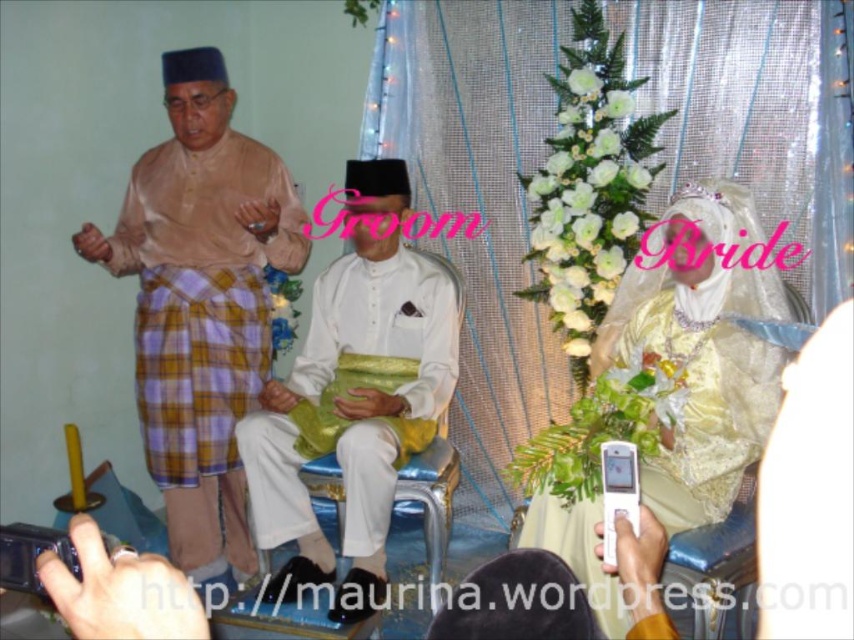
Question: From the image, what is the correct spatial relationship of matte brown shirt at left in relation to white satin dress at upper right?

Choices:
 (A) above
 (B) below

Answer: (A)

Question: Based on their relative distances, which object is farther from the white satin dress at upper right?

Choices:
 (A) white satin shirt at center
 (B) matte brown shirt at left

Answer: (B)

Question: Among these objects, which one is farthest from the camera?

Choices:
 (A) white satin shirt at center
 (B) matte brown shirt at left

Answer: (B)

Question: Which object appears farthest from the camera in this image?

Choices:
 (A) white satin shirt at center
 (B) white satin dress at upper right
 (C) matte brown shirt at left

Answer: (C)

Question: Is white satin shirt at center to the left of white satin dress at upper right from the viewer's perspective?

Choices:
 (A) no
 (B) yes

Answer: (B)

Question: Is matte brown shirt at left further to the viewer compared to white satin dress at upper right?

Choices:
 (A) yes
 (B) no

Answer: (A)